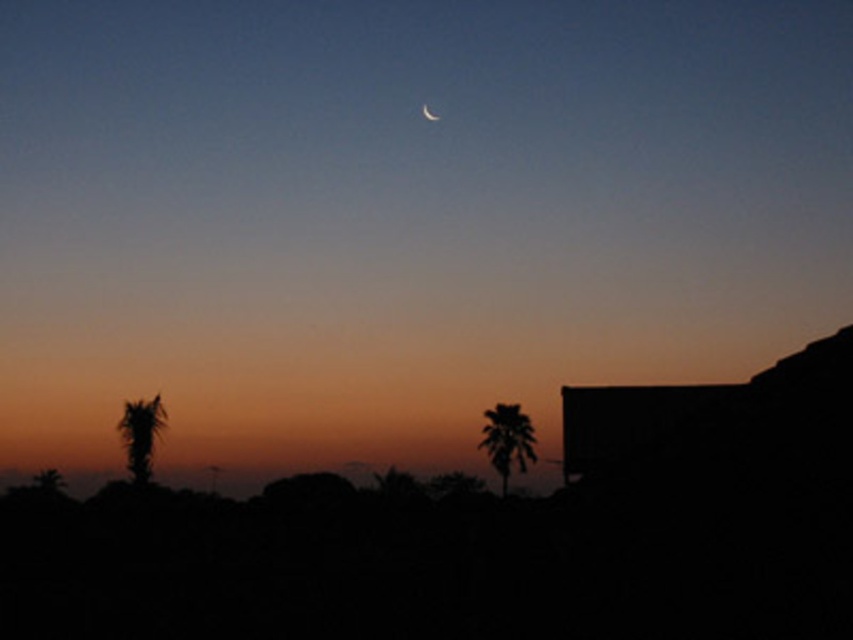
You are standing in the twilight scene and want to take a photo of the silhouette leafy palm at center. If you move 0.1 units to the right from your current position, will the palm still be in the center of your view?

The silhouette leafy palm at center is located at point [508,440]. Moving 0.1 units to the right would shift your position, but since the palm is already at the center coordinates, it would no longer be centered in your view.

You are an astronomer observing the twilight scene. You notice the silhouette leafy palm at center and the matte silver crescent at upper center. Which object is located to the right of the other?

The silhouette leafy palm at center is positioned on the right side of matte silver crescent at upper center.